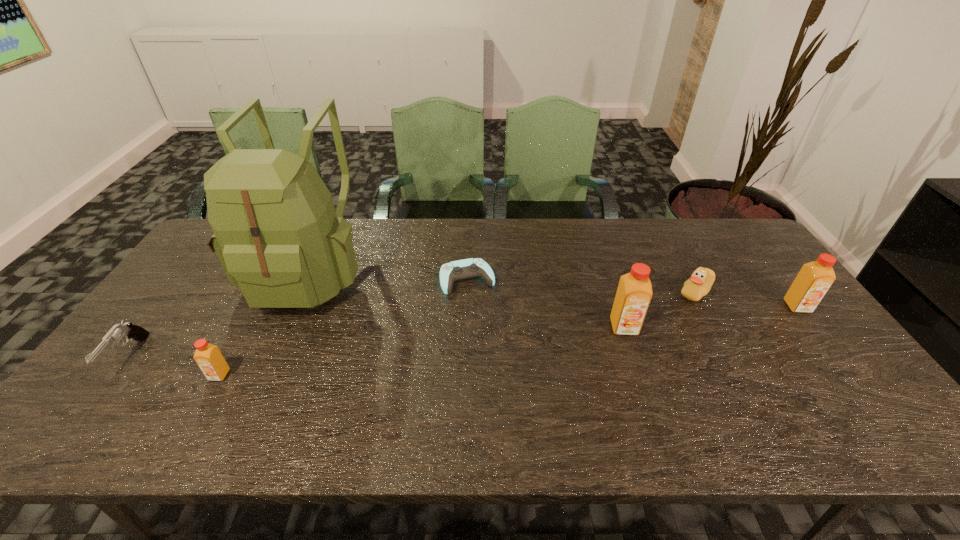
The image size is (960, 540). I want to click on the nearest orange juice, so click(x=208, y=357).

Identify the location of the leftmost orange juice. (208, 357).

I want to click on the second nearest orange juice, so click(634, 292).

Where is `the second orange juice from right to left`? the second orange juice from right to left is located at coordinates (634, 292).

I want to click on the rightmost orange juice, so click(x=814, y=279).

Find the location of a particular element. This screenshot has width=960, height=540. the farthest orange juice is located at coordinates (814, 279).

I want to click on the tallest object, so click(x=277, y=236).

At what (x,y) coordinates should I click in order to perform the action: click on duck. Please return your answer as a coordinate pair (x, y). This screenshot has height=540, width=960. Looking at the image, I should click on (699, 284).

At what (x,y) coordinates should I click in order to perform the action: click on the shortest object. Please return your answer as a coordinate pair (x, y). This screenshot has width=960, height=540. Looking at the image, I should click on (467, 268).

You are a GUI agent. You are given a task and a screenshot of the screen. Output one action in this format:
    pyautogui.click(x=<x>, y=<y>)
    Task: Click on the control
    Image resolution: width=960 pixels, height=540 pixels.
    Given the screenshot: What is the action you would take?
    pyautogui.click(x=467, y=268)